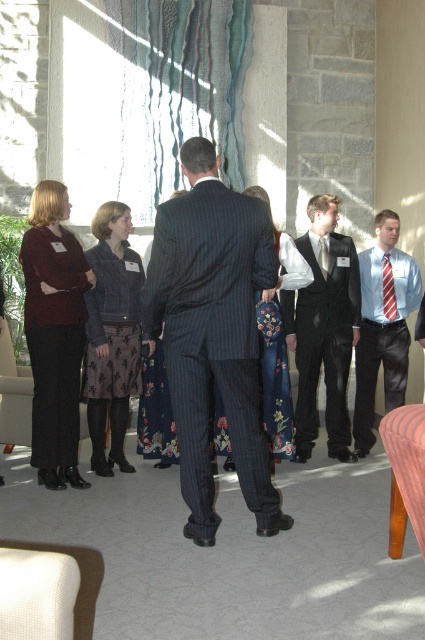
Question: Based on their relative distances, which object is nearer to the red striped tie at right?

Choices:
 (A) red striped tie at center
 (B) light blue shirt with tie at center

Answer: (B)

Question: In this image, where is black pinstripe suit at center located relative to red striped tie at right?

Choices:
 (A) below
 (B) above

Answer: (A)

Question: In this image, where is pinstriped suit at center located relative to red striped tie at center?

Choices:
 (A) left
 (B) right

Answer: (A)

Question: Estimate the real-world distances between objects in this image. Which object is closer to the denim jacket at left?

Choices:
 (A) pinstriped suit at center
 (B) matte burgundy sweater at left
 (C) black pinstripe suit at center

Answer: (B)

Question: Which object is positioned closest to the black pinstripe suit at center?

Choices:
 (A) pinstriped suit at center
 (B) matte burgundy sweater at left
 (C) denim jacket at left
 (D) light blue shirt with tie at center

Answer: (D)

Question: In this image, where is black pinstripe suit at center located relative to light blue shirt with tie at center?

Choices:
 (A) right
 (B) left

Answer: (B)